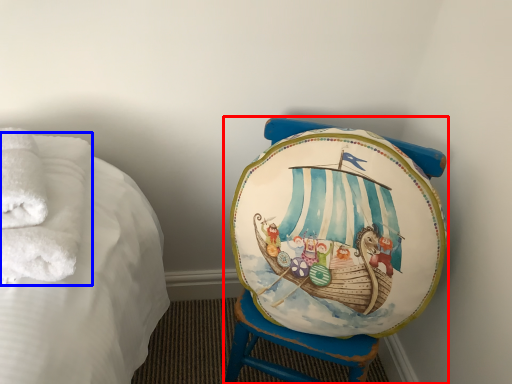
Question: Which object appears farthest to the camera in this image, furniture (highlighted by a red box) or bath towel (highlighted by a blue box)?

Choices:
 (A) furniture
 (B) bath towel

Answer: (A)